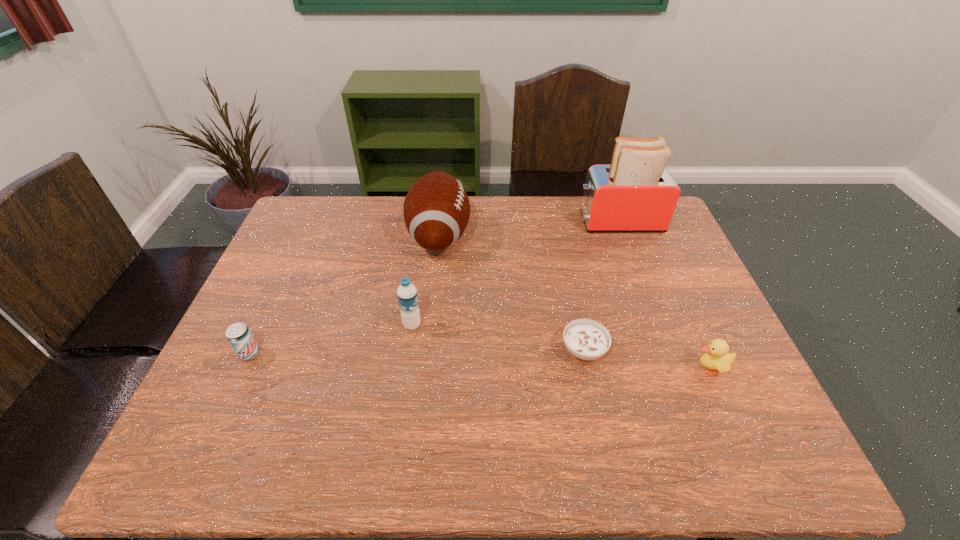
Where is `toaster that is at the right edge`? The width and height of the screenshot is (960, 540). toaster that is at the right edge is located at coordinates (635, 193).

You are a GUI agent. You are given a task and a screenshot of the screen. Output one action in this format:
    pyautogui.click(x=<x>, y=<y>)
    Task: Click on the duckling situated at the right edge
    The image size is (960, 540).
    Given the screenshot: What is the action you would take?
    pyautogui.click(x=717, y=358)

Find the location of a particular element. object located at the far right corner is located at coordinates coord(635,193).

At what (x,y) coordinates should I click in order to perform the action: click on blank space at the far edge. Please return your answer as a coordinate pair (x, y). Looking at the image, I should click on (369, 221).

This screenshot has width=960, height=540. Find the location of `free space at the near edge of the desktop`. free space at the near edge of the desktop is located at coordinates (710, 467).

In the image, there is a desktop. Find the location of `vacant region at the left edge`. vacant region at the left edge is located at coordinates (297, 256).

The height and width of the screenshot is (540, 960). In the image, there is a desktop. What are the coordinates of `vacant space at the right edge` in the screenshot? It's located at (669, 249).

In the image, there is a desktop. At what (x,y) coordinates should I click in order to perform the action: click on vacant space at the far left corner. Please return your answer as a coordinate pair (x, y). The image size is (960, 540). Looking at the image, I should click on (304, 221).

Find the location of a particular element. This screenshot has height=540, width=960. vacant space that is in between the soup bowl and the water bottle is located at coordinates (498, 338).

The image size is (960, 540). Find the location of `free space between the leftmost object and the tallest object`. free space between the leftmost object and the tallest object is located at coordinates (434, 287).